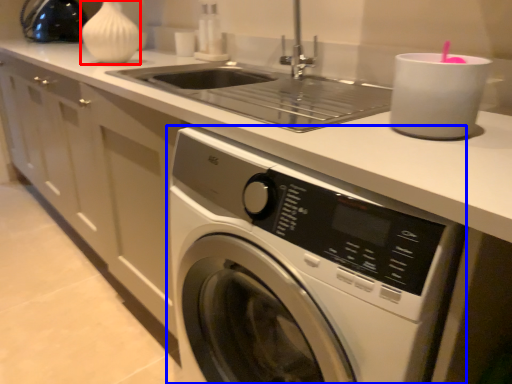
Question: Among these objects, which one is farthest to the camera, vase (highlighted by a red box) or washing machine (highlighted by a blue box)?

Choices:
 (A) vase
 (B) washing machine

Answer: (A)